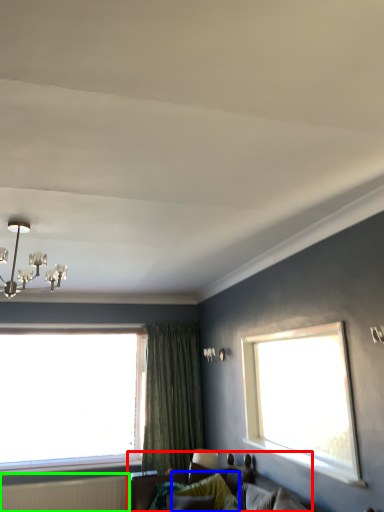
Question: Which is farther away from studio couch (highlighted by a red box)? pillow (highlighted by a blue box) or radiator (highlighted by a green box)?

Choices:
 (A) pillow
 (B) radiator

Answer: (B)